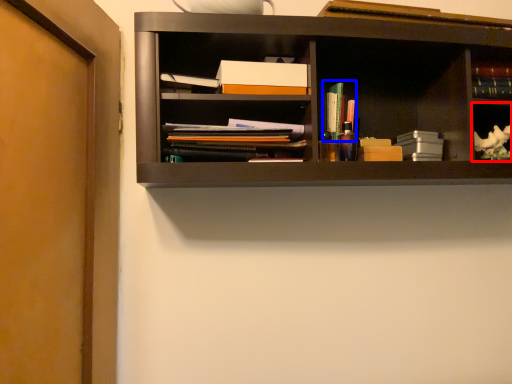
Question: Which object appears farthest to the camera in this image, cabinet (highlighted by a red box) or book (highlighted by a blue box)?

Choices:
 (A) cabinet
 (B) book

Answer: (B)